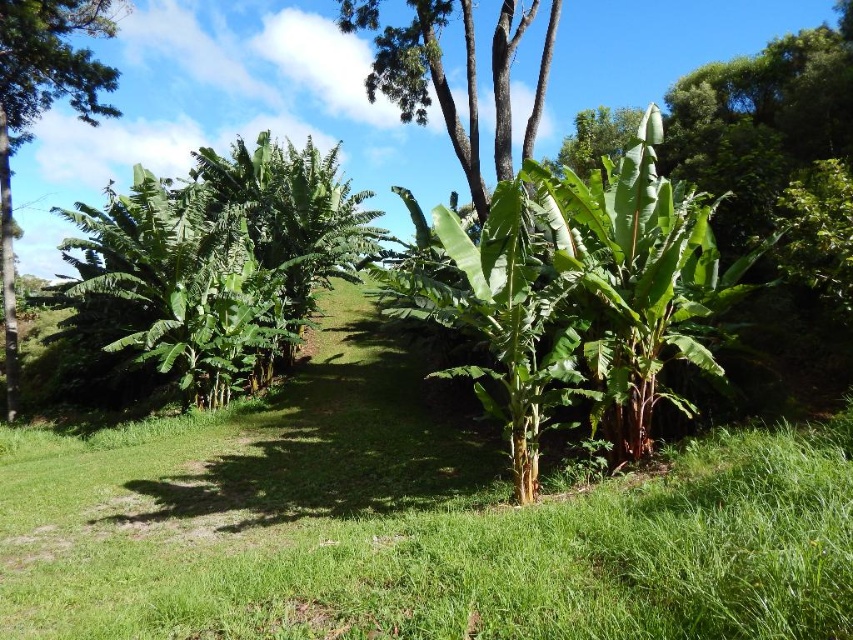
Who is more forward, (599, 320) or (344, 19)?

Point (599, 320) is more forward.

Who is lower down, green leafy banana tree at center or green leafy tree at center?

green leafy banana tree at center

The image size is (853, 640). Identify the location of green leafy banana tree at center. (581, 294).

Find the location of a particular element. This screenshot has width=853, height=640. green leafy banana tree at center is located at coordinates (581, 294).

Is green leafy banana tree at center to the right of green leafy tree at left from the viewer's perspective?

Correct, you'll find green leafy banana tree at center to the right of green leafy tree at left.

In the scene shown: Does green leafy banana tree at center have a lesser height compared to green leafy tree at left?

No.

Is point (682, 221) positioned in front of point (20, 17)?

Yes, point (682, 221) is closer to viewer.

Locate an element on the screen. This screenshot has height=640, width=853. green leafy banana tree at center is located at coordinates (581, 294).

Is green leafy tree at center further to the viewer compared to green leafy tree at left?

No, it is in front of green leafy tree at left.

Which is behind, point (415, 68) or point (67, 92)?

The point (67, 92) is behind.

This screenshot has height=640, width=853. I want to click on green leafy tree at center, so click(x=430, y=81).